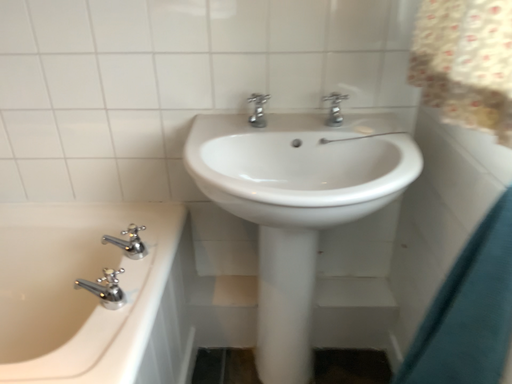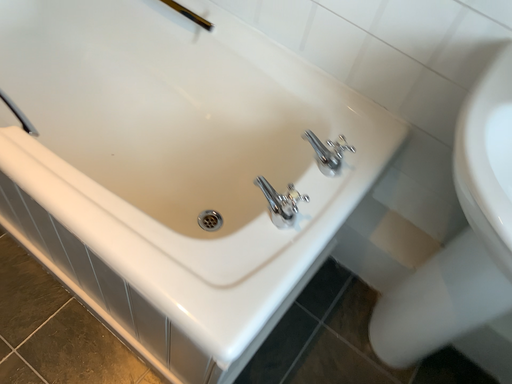
Question: How did the camera likely rotate when shooting the video?

Choices:
 (A) rotated downward
 (B) rotated upward

Answer: (A)